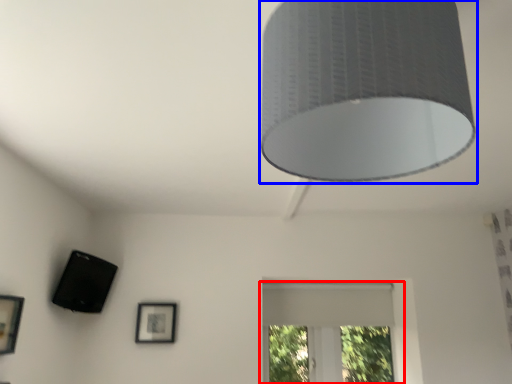
Question: Which of the following is the closest to the observer, window (highlighted by a red box) or lamp (highlighted by a blue box)?

Choices:
 (A) window
 (B) lamp

Answer: (B)